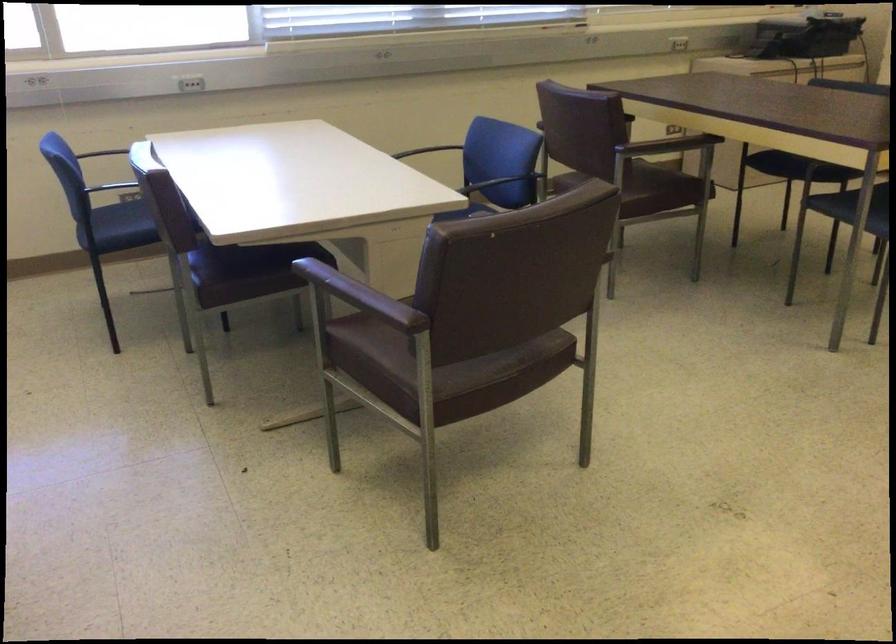
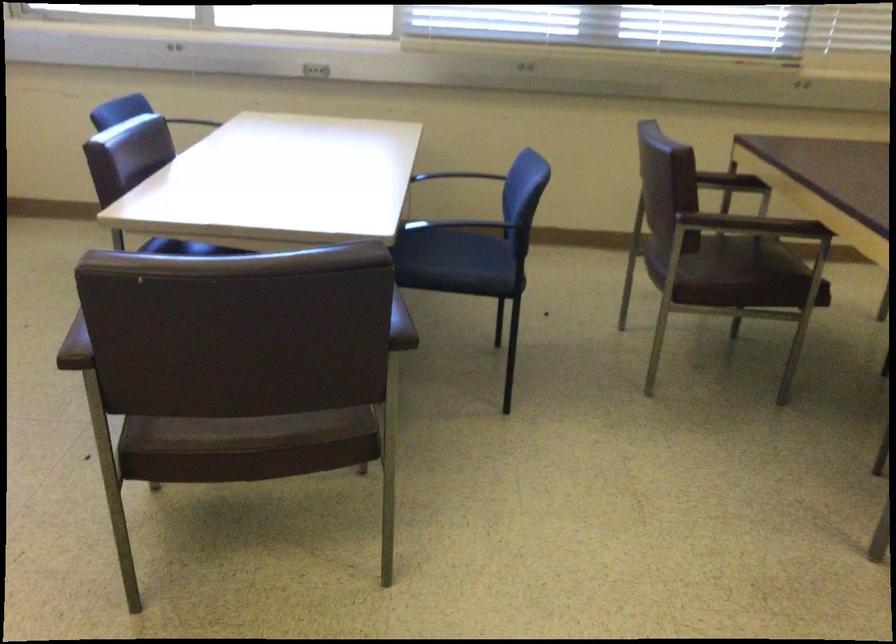
In the second image, find the point that corresponds to pixel 494 361 in the first image.

(254, 431)